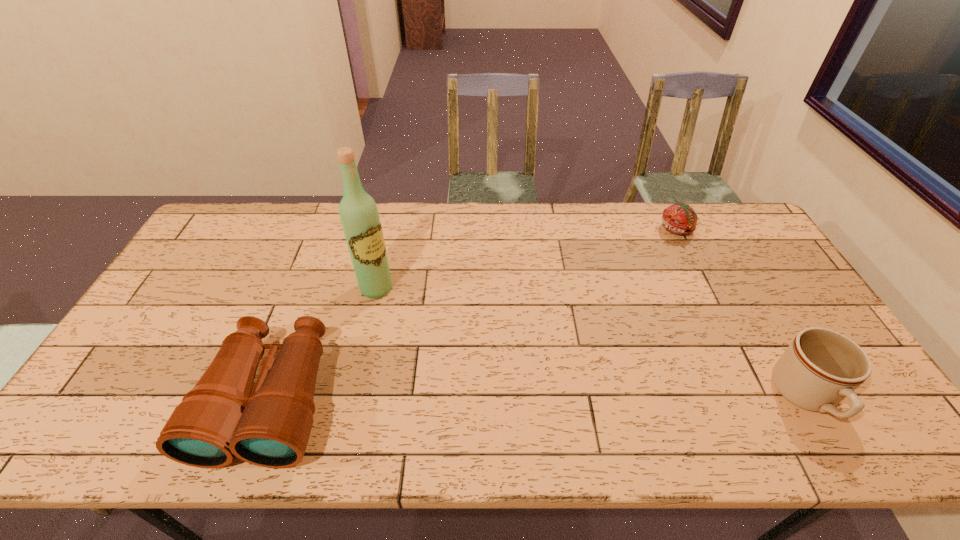
Find the location of a particular element. This screenshot has height=540, width=960. vacant space located on the front-facing side of the farthest object is located at coordinates (658, 267).

Locate an element on the screen. vacant region located on the front-facing side of the farthest object is located at coordinates (662, 258).

Locate an element on the screen. The height and width of the screenshot is (540, 960). object located in the far edge section of the desktop is located at coordinates (680, 219).

Where is `binoculars positioned at the near edge`? Image resolution: width=960 pixels, height=540 pixels. binoculars positioned at the near edge is located at coordinates (219, 418).

Where is `mug at the near edge`? The width and height of the screenshot is (960, 540). mug at the near edge is located at coordinates (821, 367).

You are a GUI agent. You are given a task and a screenshot of the screen. Output one action in this format:
    pyautogui.click(x=<x>, y=<y>)
    Task: Click on the object that is at the right edge
    This screenshot has width=960, height=540.
    Given the screenshot: What is the action you would take?
    pyautogui.click(x=821, y=367)

At what (x,y) coordinates should I click in order to perform the action: click on object positioned at the near right corner. Please return your answer as a coordinate pair (x, y). This screenshot has width=960, height=540. Looking at the image, I should click on (821, 367).

At what (x,y) coordinates should I click in order to perform the action: click on vacant area at the far edge. Please return your answer as a coordinate pair (x, y). Image resolution: width=960 pixels, height=540 pixels. Looking at the image, I should click on (642, 226).

Locate an element on the screen. This screenshot has height=540, width=960. blank space at the left edge of the desktop is located at coordinates (219, 265).

In order to click on free space at the right edge of the desktop in this screenshot , I will do `click(760, 274)`.